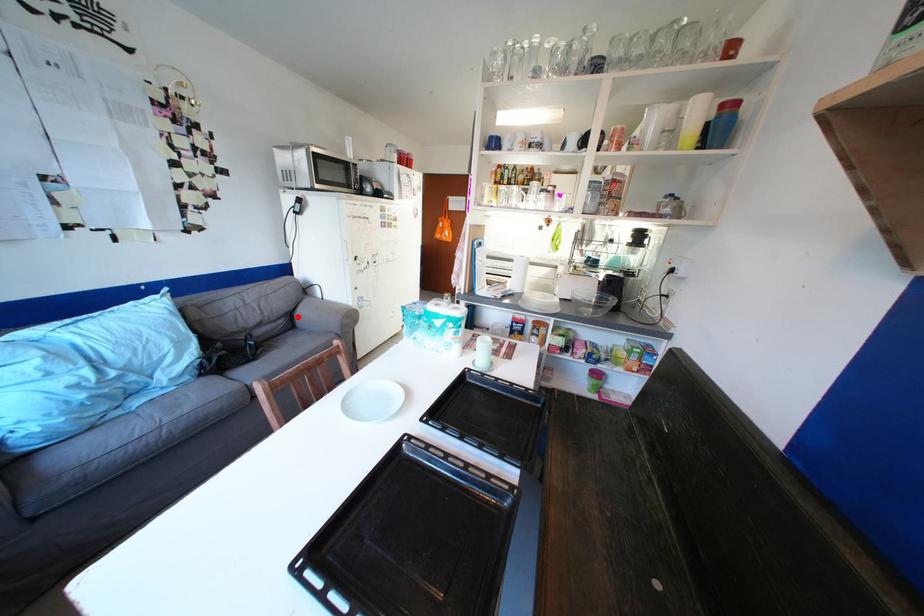
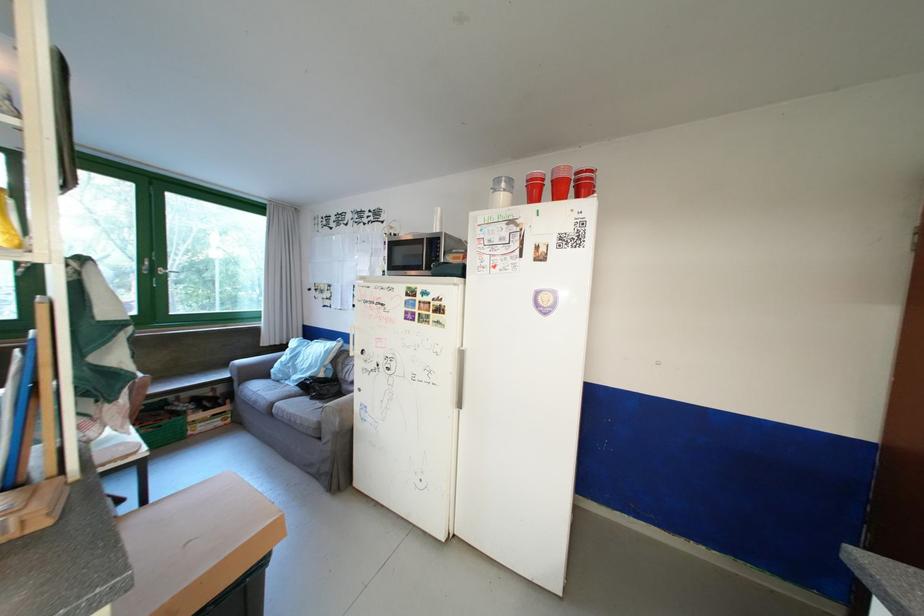
Question: I am providing you with two images of the same scene from different viewpoints. A red point is marked on the first image. Is the red point's position out of view in image 2?

Choices:
 (A) Yes
 (B) No

Answer: (A)